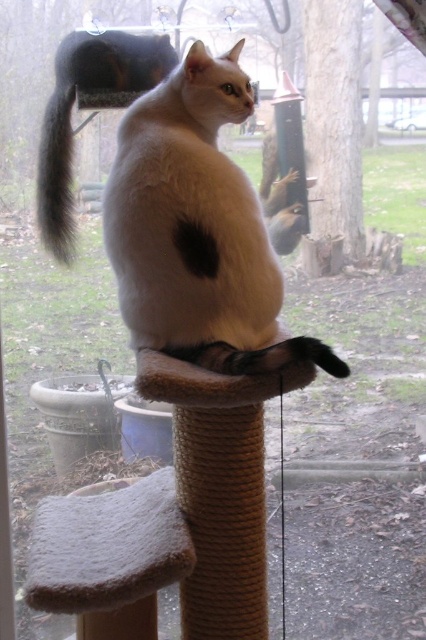
Between point (37, 179) and point (221, 358), which one is positioned in front?

Point (221, 358) is in front.

Which is behind, point (54, 92) or point (334, 353)?

The point (54, 92) is more distant.

Which is behind, point (62, 124) or point (264, 364)?

Point (62, 124)

Locate an element on the screen. black fur tail at upper left is located at coordinates (55, 176).

Does white fur cat at upper center have a lesser height compared to black fur tail at upper left?

No, white fur cat at upper center is not shorter than black fur tail at upper left.

Is white fur cat at upper center to the left of black fur tail at upper left from the viewer's perspective?

No, white fur cat at upper center is not to the left of black fur tail at upper left.

The image size is (426, 640). What do you see at coordinates (89, 108) in the screenshot?
I see `white fur cat at upper center` at bounding box center [89, 108].

Identify the location of white fur cat at upper center. The height and width of the screenshot is (640, 426). (89, 108).

Can you confirm if sisal rope cat tree at center is wider than black fur tail at upper left?

Yes.

Who is taller, sisal rope cat tree at center or black fur tail at upper left?

sisal rope cat tree at center is taller.

Identify the location of sisal rope cat tree at center. (219, 486).